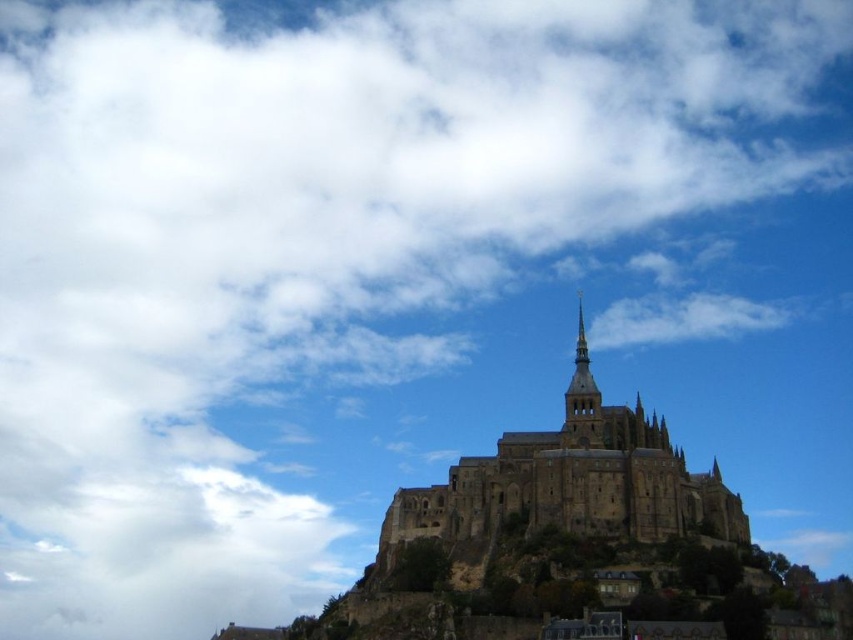
Question: Which point is farther to the camera?

Choices:
 (A) (582, 394)
 (B) (581, 435)

Answer: (A)

Question: Among these objects, which one is farthest from the camera?

Choices:
 (A) golden stone spire at center
 (B) brown stone castle at center

Answer: (A)

Question: Is brown stone castle at center bigger than golden stone spire at center?

Choices:
 (A) yes
 (B) no

Answer: (A)

Question: Does brown stone castle at center appear on the right side of golden stone spire at center?

Choices:
 (A) yes
 (B) no

Answer: (B)

Question: Can you confirm if brown stone castle at center is positioned to the right of golden stone spire at center?

Choices:
 (A) no
 (B) yes

Answer: (A)